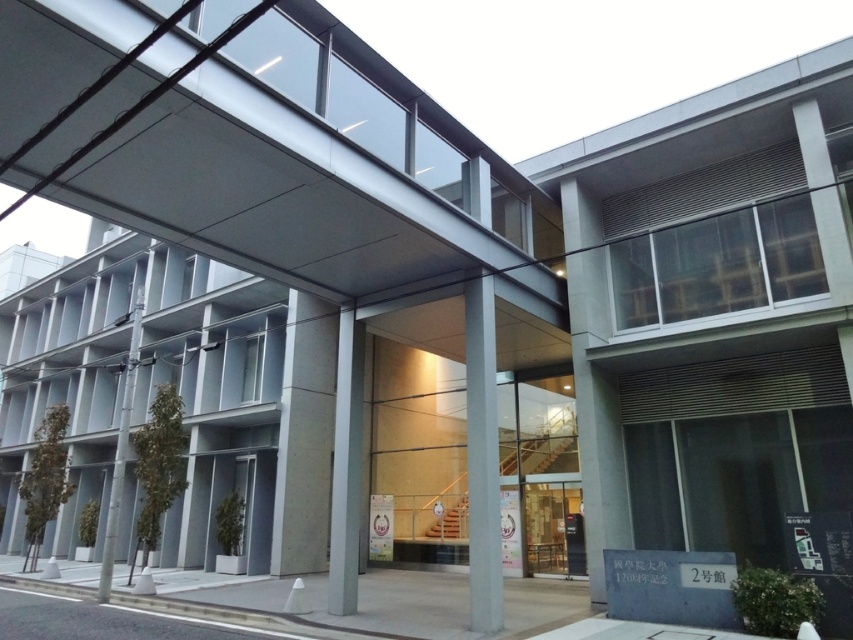
Question: Is smooth concrete pillar at center bigger than gray concrete pillar at left?

Choices:
 (A) no
 (B) yes

Answer: (A)

Question: Estimate the real-world distances between objects in this image. Which object is farther from the gray concrete pillar at left?

Choices:
 (A) sleek concrete pillar at center
 (B) smooth concrete pillar at center

Answer: (A)

Question: Which object is the farthest from the sleek concrete pillar at center?

Choices:
 (A) smooth concrete pillar at center
 (B) gray concrete pillar at left

Answer: (B)

Question: Estimate the real-world distances between objects in this image. Which object is closer to the smooth concrete pillar at center?

Choices:
 (A) sleek concrete pillar at center
 (B) gray concrete pillar at left

Answer: (A)

Question: Is smooth concrete pillar at center positioned at the back of gray concrete pillar at left?

Choices:
 (A) yes
 (B) no

Answer: (B)

Question: Does sleek concrete pillar at center have a lesser width compared to gray concrete pillar at left?

Choices:
 (A) yes
 (B) no

Answer: (A)